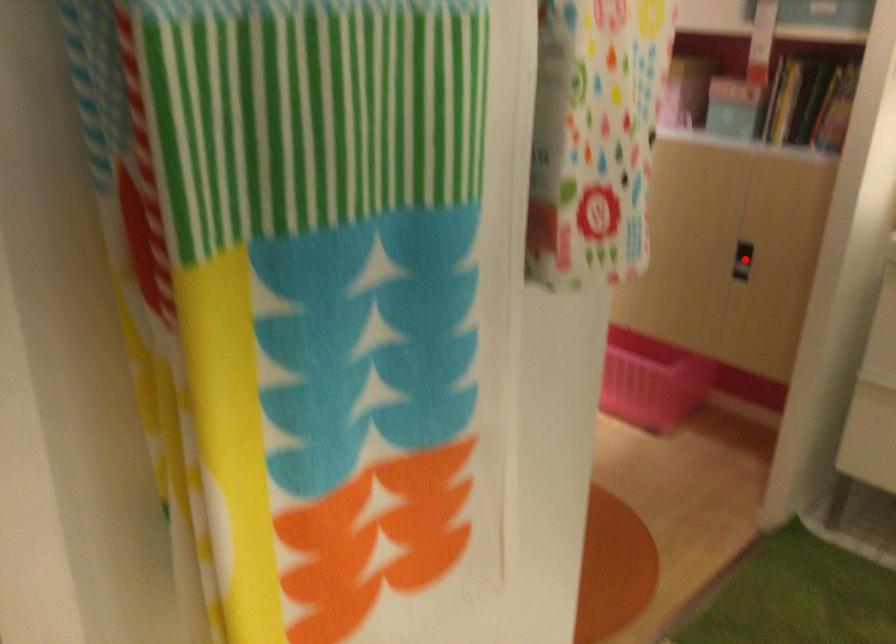
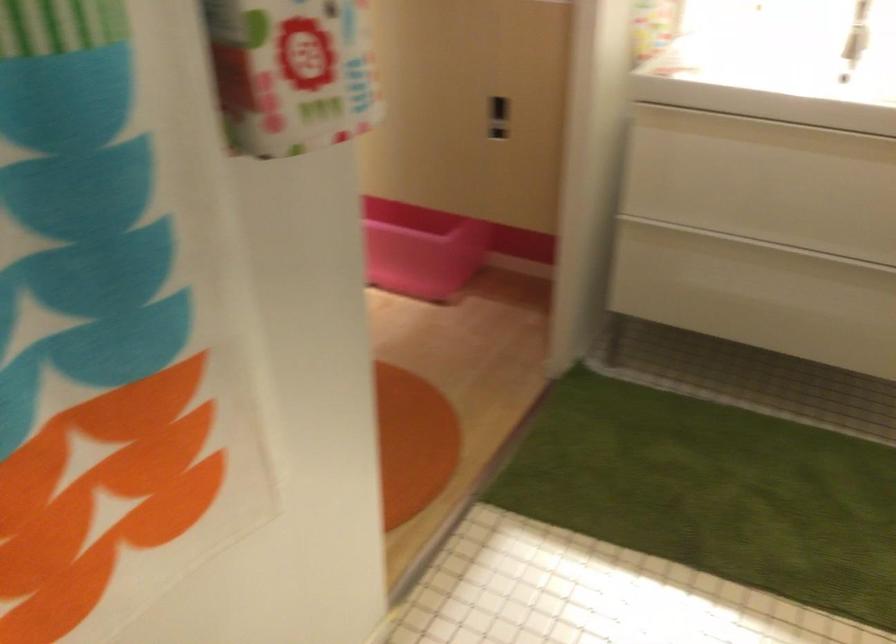
Where in the second image is the point corresponding to the highlighted location from the first image?

(497, 118)